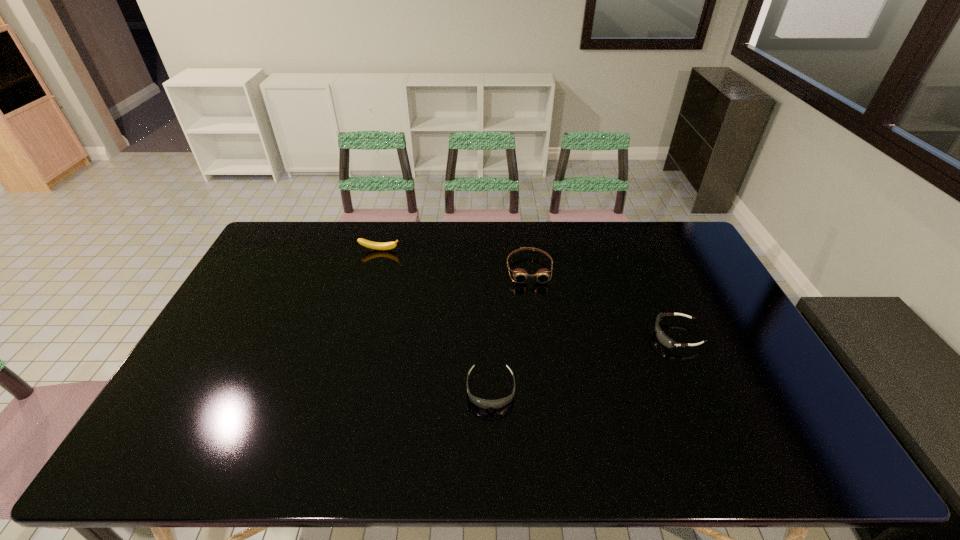
Find the location of a particular element. The height and width of the screenshot is (540, 960). vacant space in between the second nearest object and the nearest object is located at coordinates (584, 362).

Locate an element on the screen. free area in between the banana and the second nearest object is located at coordinates (528, 293).

Locate an element on the screen. The height and width of the screenshot is (540, 960). free space between the farthest object and the nearest goggles is located at coordinates (435, 320).

At what (x,y) coordinates should I click in order to perform the action: click on unoccupied area between the nearest goggles and the second nearest object. Please return your answer as a coordinate pair (x, y). Looking at the image, I should click on (584, 362).

Locate which object ranks third in proximity to the banana. Please provide its 2D coordinates. Your answer should be formatted as a tuple, i.e. [(x, y)], where the tuple contains the x and y coordinates of a point satisfying the conditions above.

[(661, 336)]

Locate which object ranks second in proximity to the farthest object. Please provide its 2D coordinates. Your answer should be formatted as a tuple, i.e. [(x, y)], where the tuple contains the x and y coordinates of a point satisfying the conditions above.

[(482, 403)]

Identify which goggles is located as the nearest to the leftmost goggles. Please provide its 2D coordinates. Your answer should be formatted as a tuple, i.e. [(x, y)], where the tuple contains the x and y coordinates of a point satisfying the conditions above.

[(520, 275)]

Identify the location of goggles identified as the third closest to the farthest object. (661, 336).

Where is `free spot that satisfies the following two spatial constraints: 1. on the front and sides of the second nearest goggles; 2. on the lenses of the nearest object`? The height and width of the screenshot is (540, 960). free spot that satisfies the following two spatial constraints: 1. on the front and sides of the second nearest goggles; 2. on the lenses of the nearest object is located at coordinates (700, 389).

In order to click on free point that satisfies the following two spatial constraints: 1. on the front and sides of the second farthest goggles; 2. on the lenses of the leftmost goggles in this screenshot , I will do `click(700, 389)`.